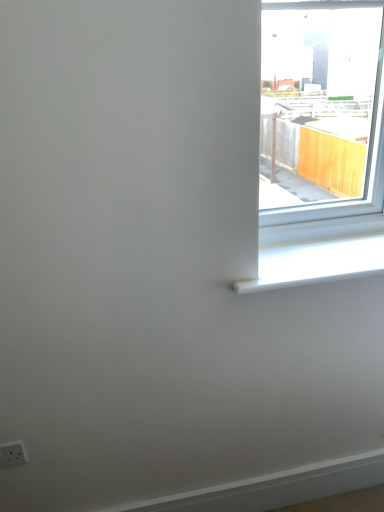
Question: From the image's perspective, relative to white plastic window sill at upper right, is white plastic electric outlet at lower left above or below?

Choices:
 (A) below
 (B) above

Answer: (A)

Question: In the image, is white plastic electric outlet at lower left positioned in front of or behind white plastic window sill at upper right?

Choices:
 (A) behind
 (B) front

Answer: (A)

Question: Based on their sizes in the image, would you say white plastic electric outlet at lower left is bigger or smaller than white plastic window sill at upper right?

Choices:
 (A) big
 (B) small

Answer: (B)

Question: Considering the positions of point (362, 266) and point (8, 451), is point (362, 266) closer or farther from the camera than point (8, 451)?

Choices:
 (A) closer
 (B) farther

Answer: (A)

Question: From a real-world perspective, relative to white plastic electric outlet at lower left, is white plastic window sill at upper right vertically above or below?

Choices:
 (A) above
 (B) below

Answer: (A)

Question: From the image's perspective, relative to white plastic electric outlet at lower left, is white plastic window sill at upper right above or below?

Choices:
 (A) above
 (B) below

Answer: (A)

Question: Is white plastic window sill at upper right bigger or smaller than white plastic electric outlet at lower left?

Choices:
 (A) small
 (B) big

Answer: (B)